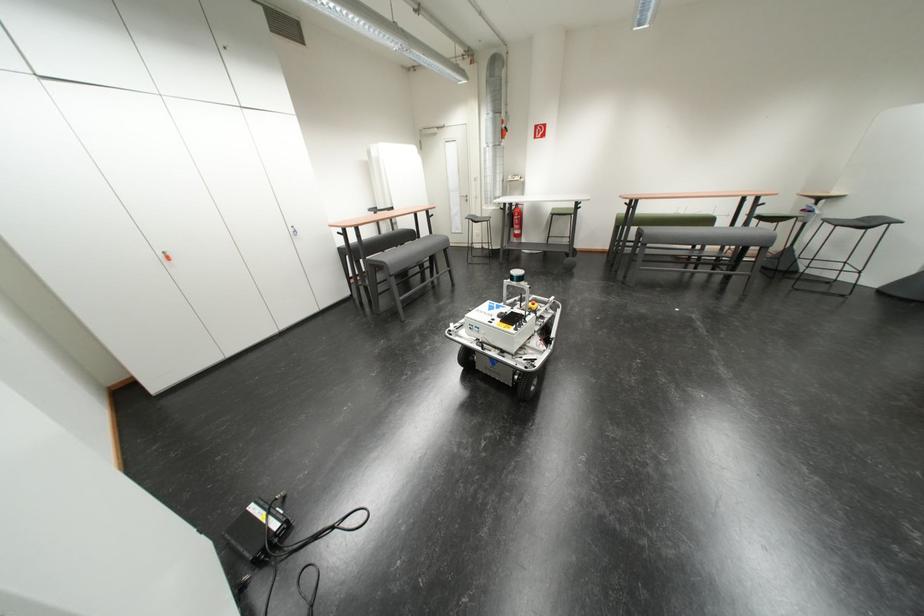
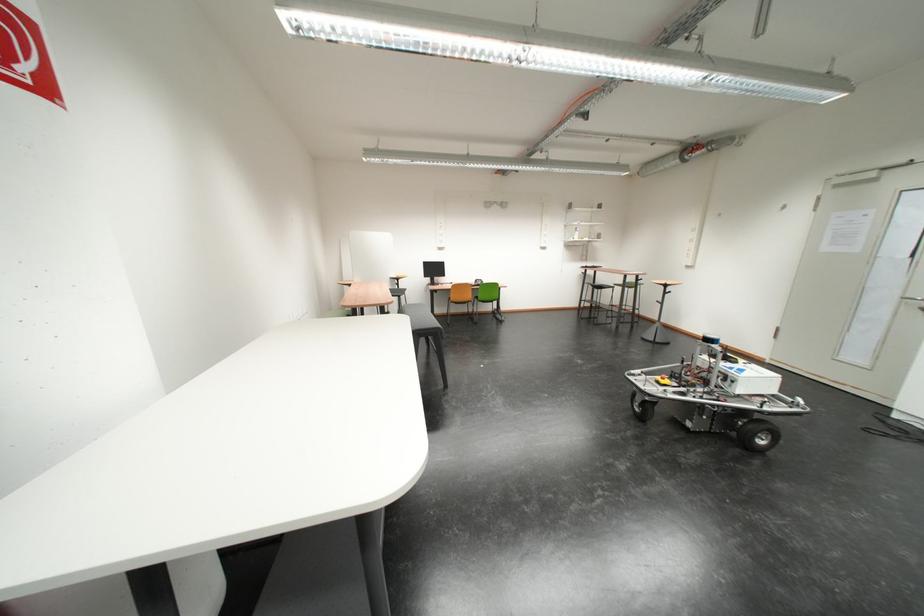
Question: I am providing you with two images of the same scene from different viewpoints. Which of the following objects are not visible in image2?

Choices:
 (A) sofa sitting surface
 (B) metal bed handle
 (C) red robot button
 (D) black stool sitting surface

Answer: (A)